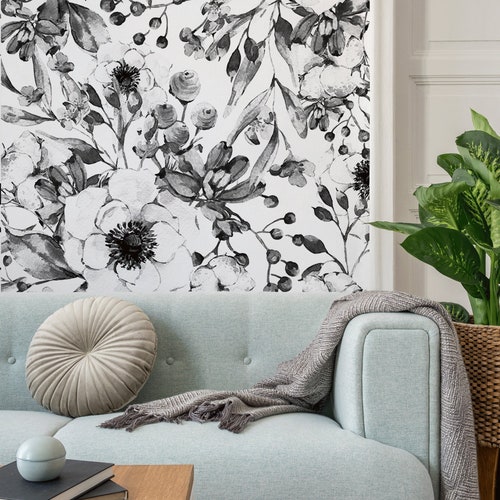
In order to click on throw blanet in this screenshot , I will do `click(473, 452)`.